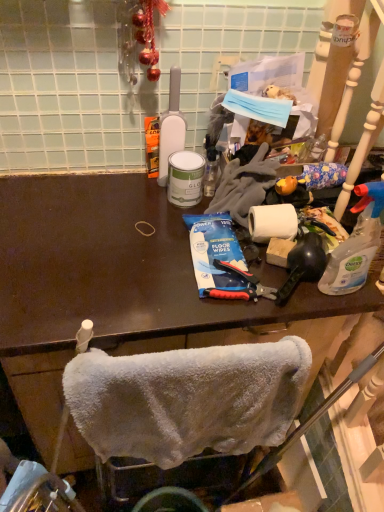
Question: Is blue plastic toothpaste at center inside or outside of white matte bottle at upper center, which is the 2th bottle in right-to-left order?

Choices:
 (A) outside
 (B) inside

Answer: (A)

Question: Is point (215, 283) closer or farther from the camera than point (160, 119)?

Choices:
 (A) farther
 (B) closer

Answer: (B)

Question: Which object is positioned farthest from the white matte bottle at upper center, the 2th bottle ordered from the bottom?

Choices:
 (A) white fluffy towel at lower center
 (B) clear plastic spray bottle at right, the first bottle from the front
 (C) blue plastic toothpaste at center

Answer: (A)

Question: Estimate the real-world distances between objects in this image. Which object is farther from the white matte bottle at upper center, placed as the 1th bottle when sorted from left to right?

Choices:
 (A) blue plastic toothpaste at center
 (B) clear plastic spray bottle at right, acting as the 2th bottle starting from the left
 (C) white fluffy towel at lower center

Answer: (C)